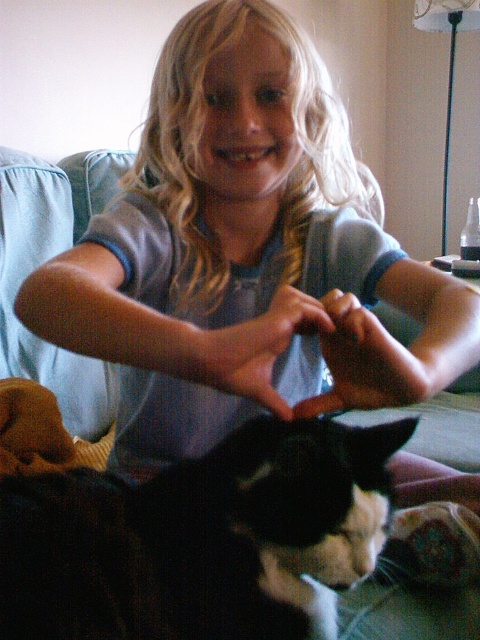
You are a delivery robot that needs to place a small package between the matte blue shirt at center and the black fur cat at lower left. The package is 8 inches long. Can you fit it in the space between them?

The distance between the matte blue shirt at center and the black fur cat at lower left is 7.68 inches. Since the package is 8 inches long, it is slightly longer than the available space, so it won measurements. 8 inches is longer than 7.68 inches, so the package cannot be placed between them without overlapping.

You are a photographer trying to capture a clear shot of the black fur cat at lower left. However, the matte blue shirt at center is blocking your view. Can you adjust your position to see the cat without moving any objects?

The black fur cat at lower left is behind the matte blue shirt at center, so you can move your camera position to the side of the matte blue shirt at center to get a clear view of the black fur cat at lower left.

You are a photographer trying to capture a clear shot of the black fur cat at lower left. However, the matte blue shirt at center is blocking your view. Can you adjust your position to see the cat without moving any objects?

The matte blue shirt at center is positioned over the black fur cat at lower left, so moving your camera slightly downward or to the side might allow you to see the cat without moving any objects.